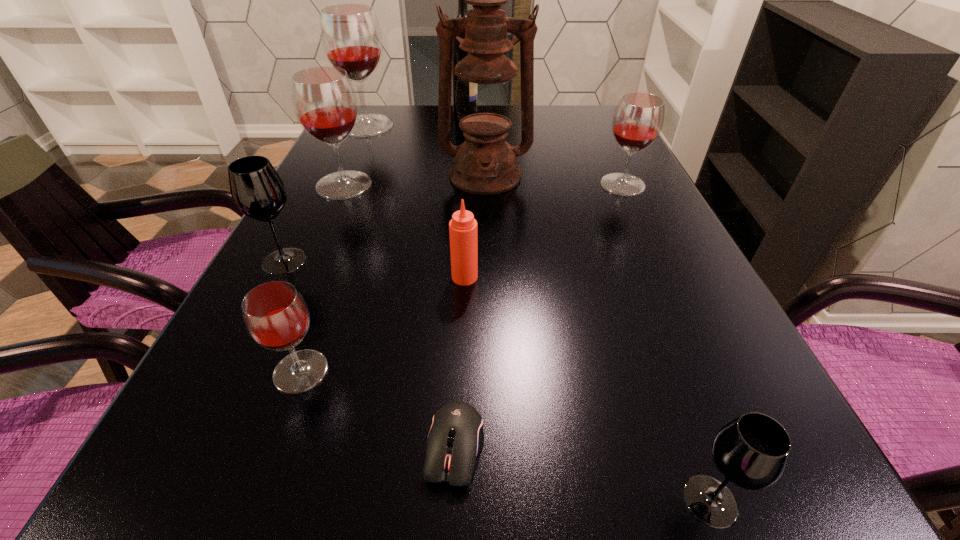
Locate an element on the screen. This screenshot has width=960, height=540. the nearest red wineglass is located at coordinates (276, 316).

I want to click on the third nearest object, so click(276, 316).

At what (x,y) coordinates should I click in order to perform the action: click on the nearest wineglass. Please return your answer as a coordinate pair (x, y). The width and height of the screenshot is (960, 540). Looking at the image, I should click on (752, 451).

You are a GUI agent. You are given a task and a screenshot of the screen. Output one action in this format:
    pyautogui.click(x=<x>, y=<y>)
    Task: Click on the smaller gray wineglass
    The image size is (960, 540).
    Given the screenshot: What is the action you would take?
    pyautogui.click(x=752, y=451)

Where is `computer mouse`? The image size is (960, 540). computer mouse is located at coordinates (455, 438).

The width and height of the screenshot is (960, 540). Find the location of `the shortest object`. the shortest object is located at coordinates (455, 438).

Where is `free space located on the label of the black wine bottle`? The height and width of the screenshot is (540, 960). free space located on the label of the black wine bottle is located at coordinates (538, 111).

This screenshot has width=960, height=540. Find the location of `free space located 0.390m on the front of the oil lamp`. free space located 0.390m on the front of the oil lamp is located at coordinates (488, 319).

The height and width of the screenshot is (540, 960). I want to click on free location located 0.170m on the right of the biggest red wineglass, so click(x=450, y=126).

The height and width of the screenshot is (540, 960). Find the location of `vacant point located on the front of the second tallest wineglass`. vacant point located on the front of the second tallest wineglass is located at coordinates (332, 212).